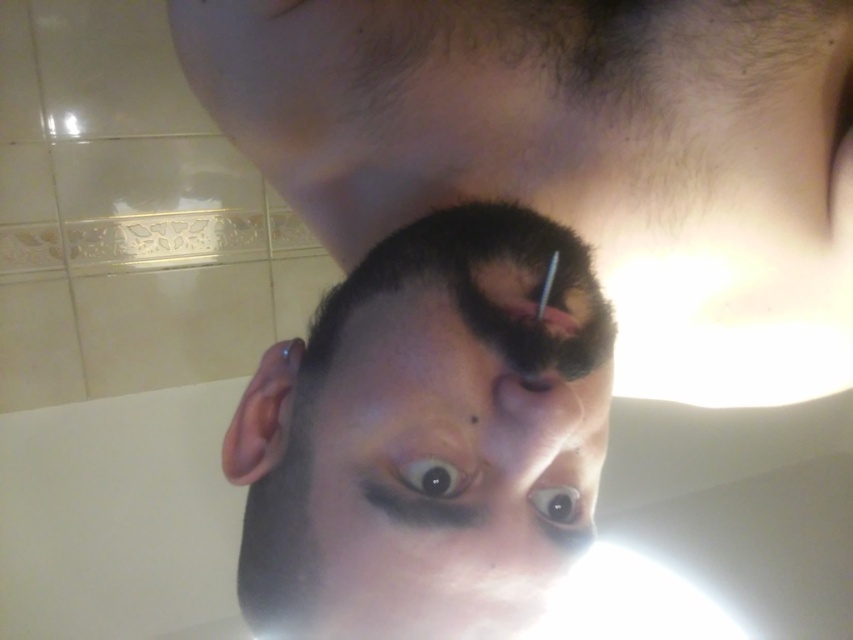
Looking at this image, you are a photographer trying to capture a closeup of the shiny black hair at center. The camera you are using has a minimum focusing distance of 10 inches. Can you take the photo without moving the camera closer?

The shiny black hair at center and camera are 11.23 inches apart from each other, which is beyond the minimum focusing distance of 10 inches. Therefore, you can take the photo without moving the camera closer.

You are a makeup artist analyzing the photo. You need to determine which feature occupies more vertical space in the image between the dark brown hair at center and the brown glossy eye at center. Which one is taller?

The dark brown hair at center has a greater height compared to the brown glossy eye at center, so the dark brown hair at center occupies more vertical space.